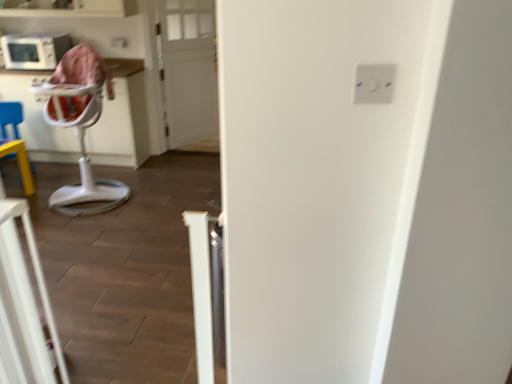
Question: Is white plastic highchair at left shorter than white plastic feeding chair at left?

Choices:
 (A) no
 (B) yes

Answer: (B)

Question: Is white plastic highchair at left to the left of white plastic feeding chair at left from the viewer's perspective?

Choices:
 (A) yes
 (B) no

Answer: (B)

Question: Can you confirm if white plastic highchair at left is positioned to the right of white plastic feeding chair at left?

Choices:
 (A) yes
 (B) no

Answer: (A)

Question: Could you tell me if white plastic highchair at left is turned towards white plastic feeding chair at left?

Choices:
 (A) no
 (B) yes

Answer: (A)

Question: Is white plastic highchair at left next to white plastic feeding chair at left and touching it?

Choices:
 (A) yes
 (B) no

Answer: (B)

Question: Is white plastic highchair at left outside of white plastic feeding chair at left?

Choices:
 (A) yes
 (B) no

Answer: (A)

Question: Can you see white plastic feeding chair at left touching white plastic electric outlet at upper right?

Choices:
 (A) no
 (B) yes

Answer: (A)

Question: Is white plastic feeding chair at left to the right of white plastic electric outlet at upper right from the viewer's perspective?

Choices:
 (A) yes
 (B) no

Answer: (B)

Question: Can you confirm if white plastic feeding chair at left is shorter than white plastic electric outlet at upper right?

Choices:
 (A) no
 (B) yes

Answer: (A)

Question: Is white plastic feeding chair at left facing towards white plastic electric outlet at upper right?

Choices:
 (A) no
 (B) yes

Answer: (A)

Question: Does white plastic feeding chair at left have a smaller size compared to white plastic electric outlet at upper right?

Choices:
 (A) no
 (B) yes

Answer: (A)

Question: From a real-world perspective, is white plastic feeding chair at left located higher than white plastic electric outlet at upper right?

Choices:
 (A) yes
 (B) no

Answer: (B)

Question: Can you confirm if white wooden door at center is smaller than white plastic highchair at left?

Choices:
 (A) no
 (B) yes

Answer: (A)